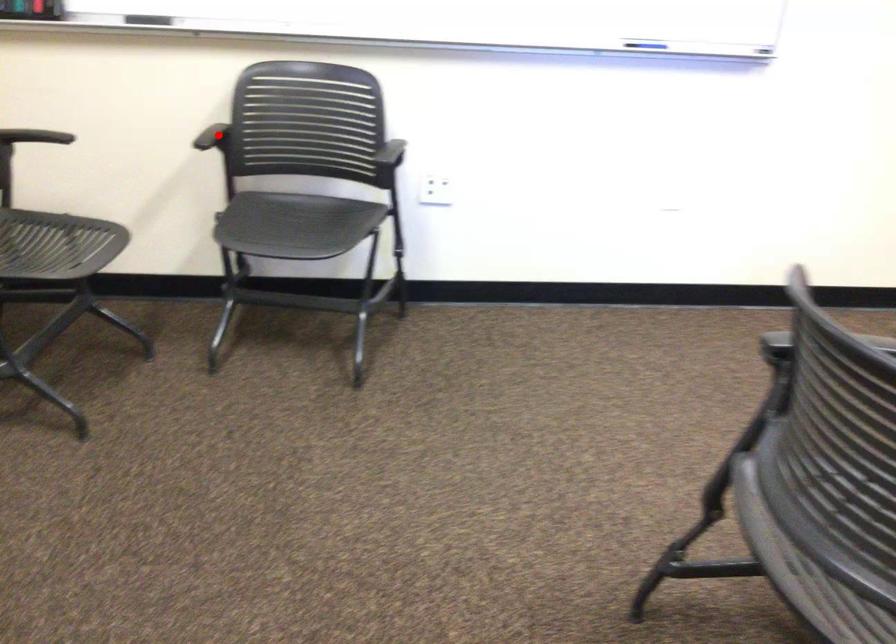
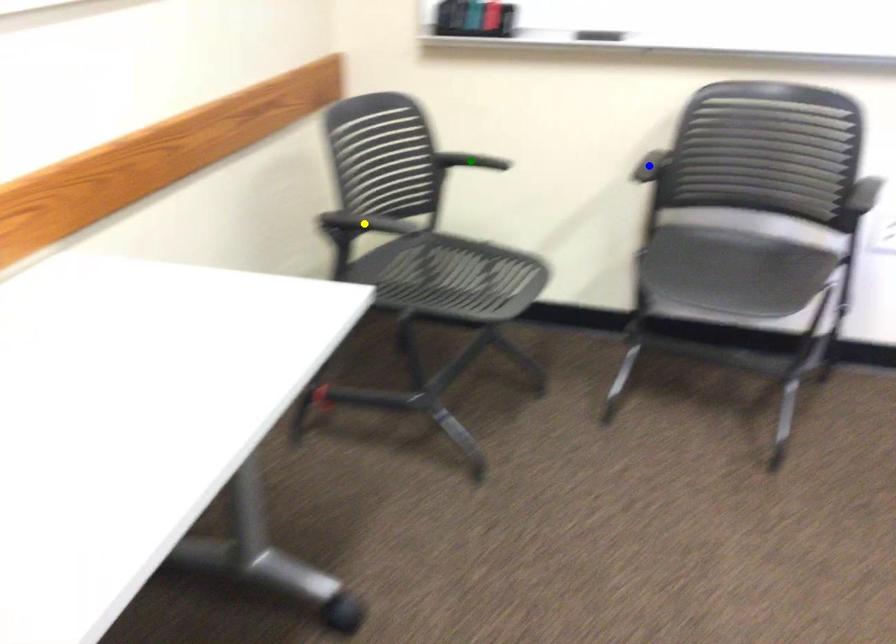
Question: I am providing you with two images of the same scene from different viewpoints. A red point is marked on the first image. You are given multiple points on the second image. Which mark in image 2 goes with the point in image 1?

Choices:
 (A) blue point
 (B) green point
 (C) yellow point

Answer: (A)